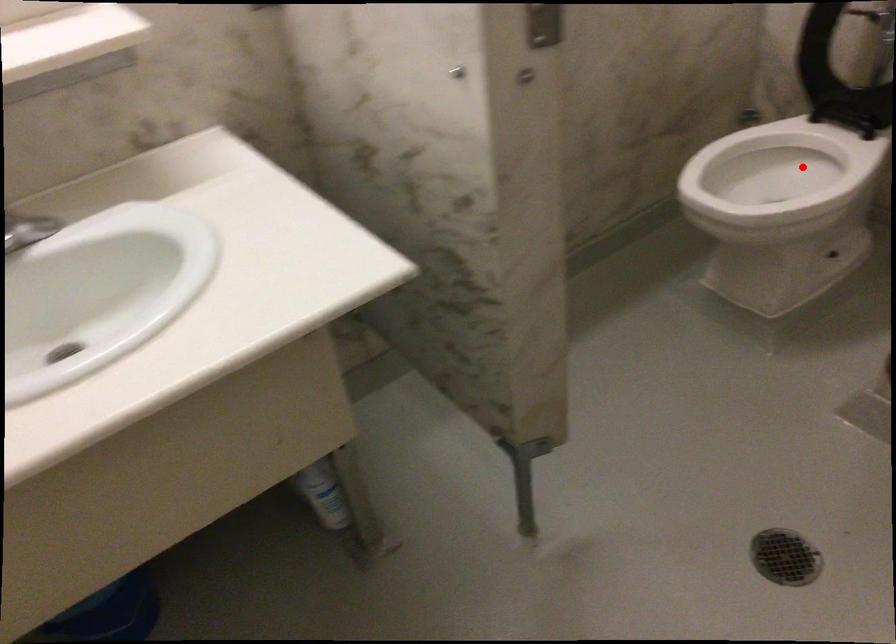
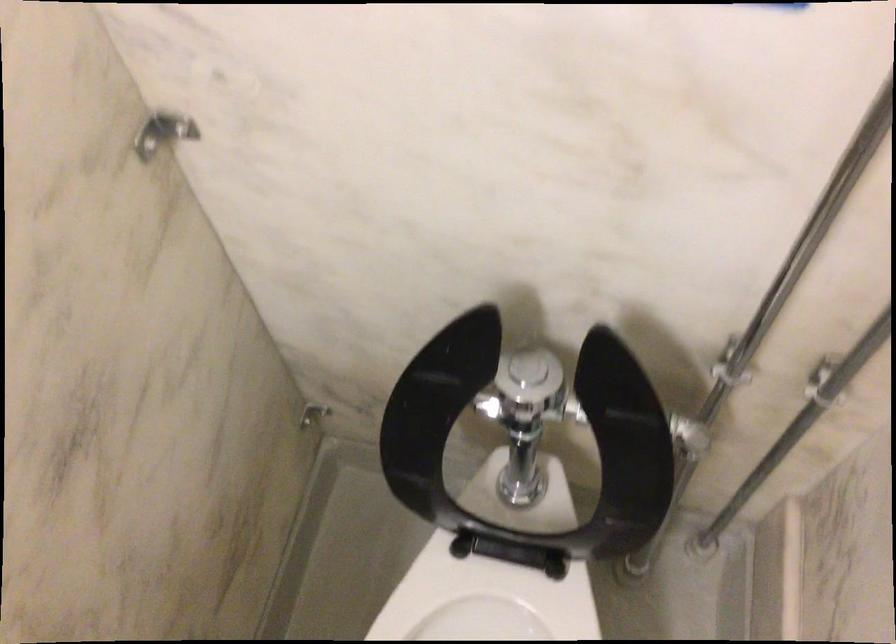
Question: I am providing you with two images of the same scene from different viewpoints. A red point is shown in image1. For the corresponding object point in image2, is it positioned nearer or farther from the camera?

Choices:
 (A) Nearer
 (B) Farther

Answer: (A)